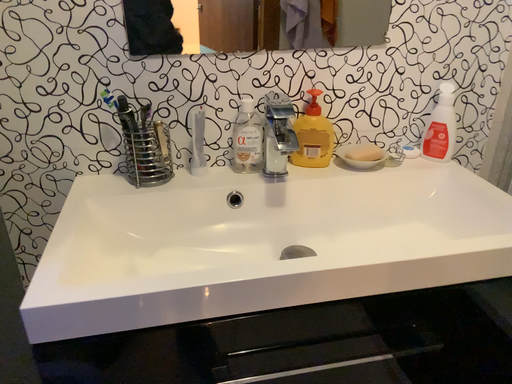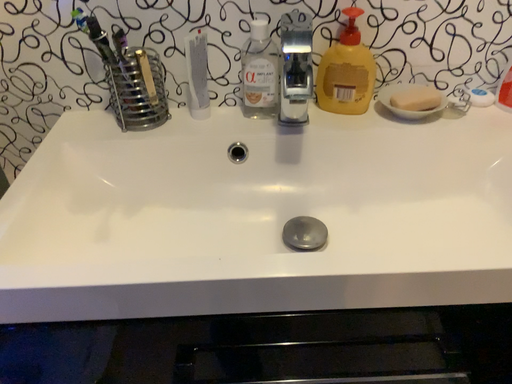
Question: Which way did the camera rotate in the video?

Choices:
 (A) rotated upward
 (B) rotated downward

Answer: (B)